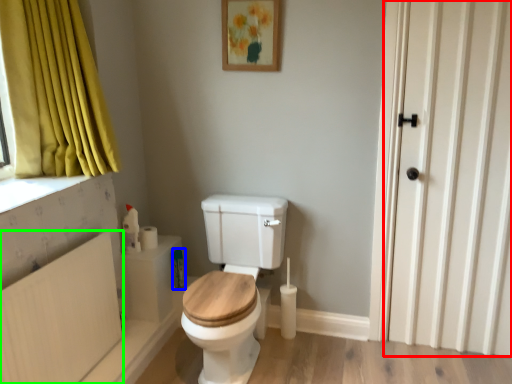
Question: Based on their relative distances, which object is nearer to door (highlighted by a red box)? Choose from toiletry (highlighted by a blue box) and radiator (highlighted by a green box).

Choices:
 (A) toiletry
 (B) radiator

Answer: (A)